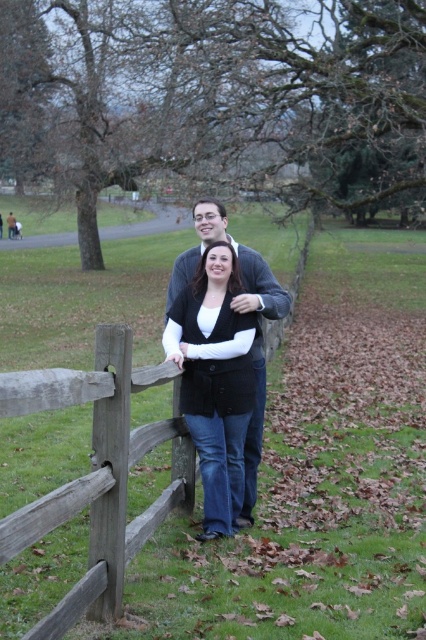
You are a photographer trying to capture a candid shot of the two people in the scene. Since you want to ensure the brown wooden fence at center and the black matte vest at center are both visible in the frame, which object should you focus on to ensure both are in focus?

The brown wooden fence at center is larger than the black matte vest at center, so focusing on the brown wooden fence at center will help ensure both are in focus as it occupies more of the frame.

You are a photographer trying to capture a clear shot of the brown wooden fence at center and the black matte vest at center. Which object should you focus on first to ensure both are in focus?

The brown wooden fence at center is closer to the viewer than the black matte vest at center, so you should focus on the brown wooden fence at center first to ensure both are in focus.

You are a photographer setting up a tripod to take a portrait of the two people in the scene. The tripod has a maximum height adjustment of 1.5 meters. Given that the brown wooden fence at center and the black matte vest at center are both in the background, will the tripod need to be raised to its maximum height to capture both objects in the frame?

The brown wooden fence at center is not as tall as the black matte vest at center, so the tripod does not need to be raised to its maximum height to capture both objects in the frame since the fence is shorter than the vest.